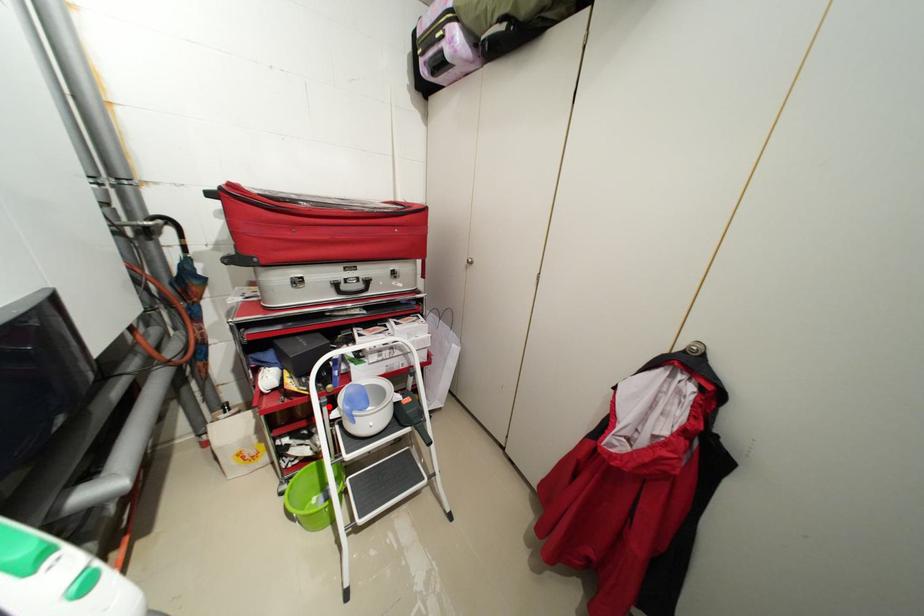
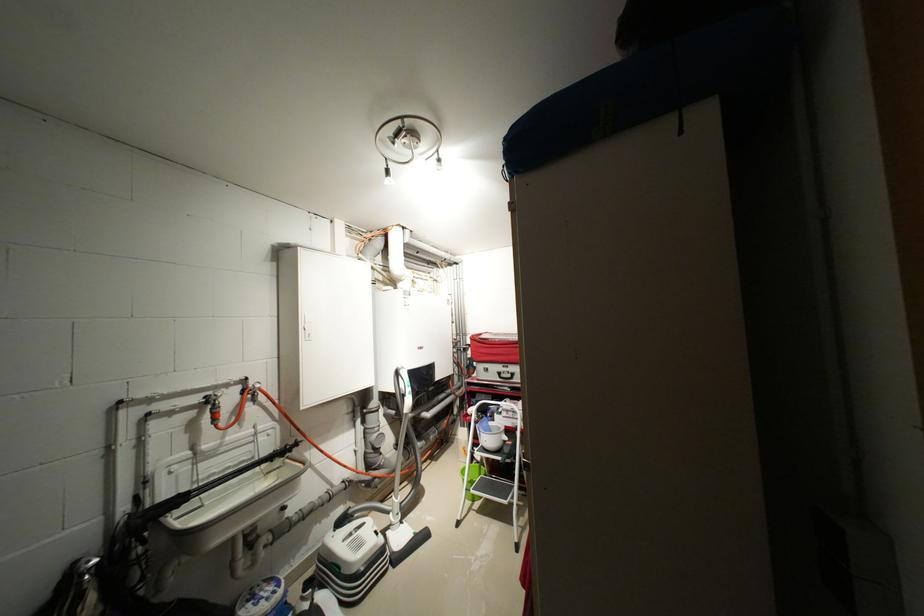
Locate, in the second image, the point that corresponds to the highlighted location in the first image.

(482, 424)